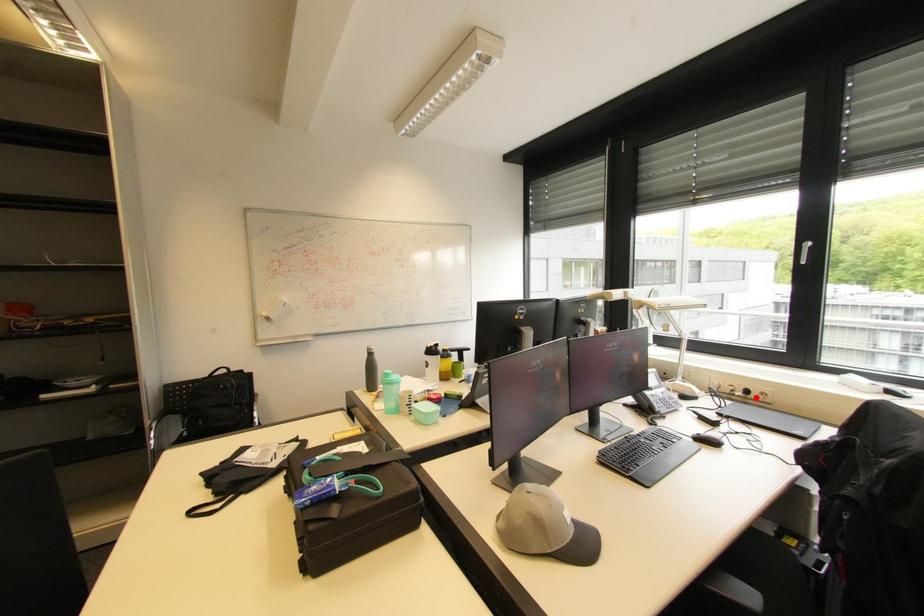
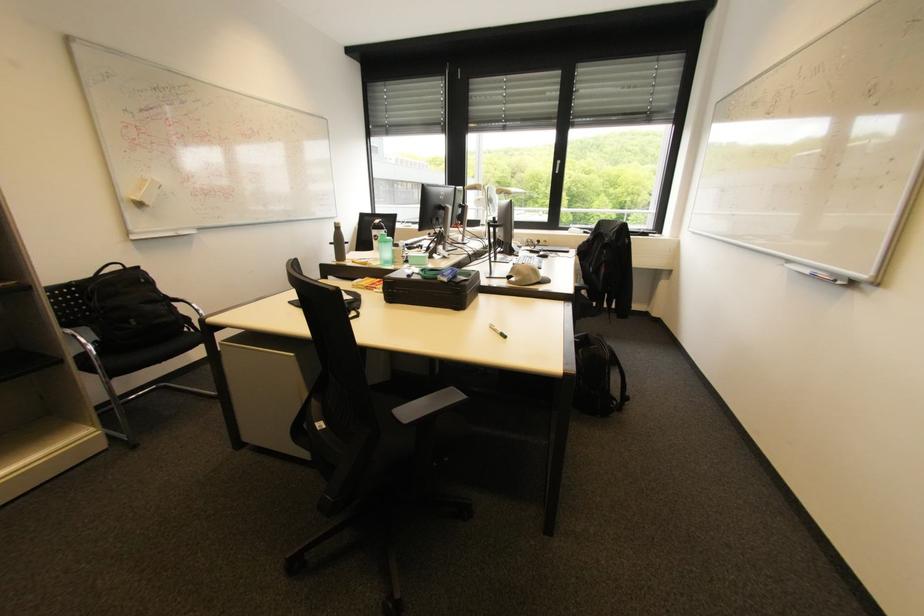
The point at the highlighted location is marked in the first image. Where is the corresponding point in the second image?

(544, 245)